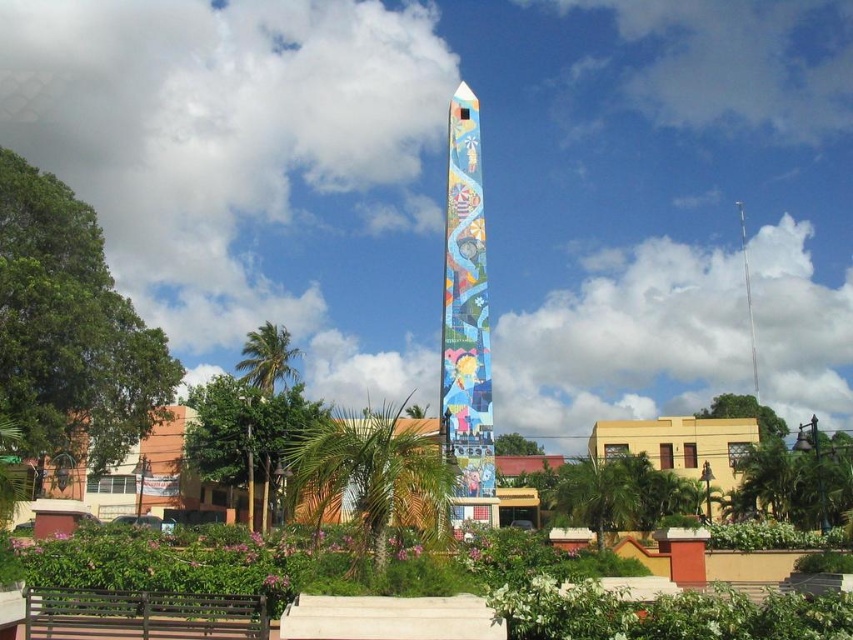
Who is higher up, multicolored mosaic obelisk at center or brown wooden bench at lower left?

Positioned higher is multicolored mosaic obelisk at center.

Between multicolored mosaic obelisk at center and brown wooden bench at lower left, which one has more height?

multicolored mosaic obelisk at center

What are the coordinates of `multicolored mosaic obelisk at center` in the screenshot? It's located at (466, 321).